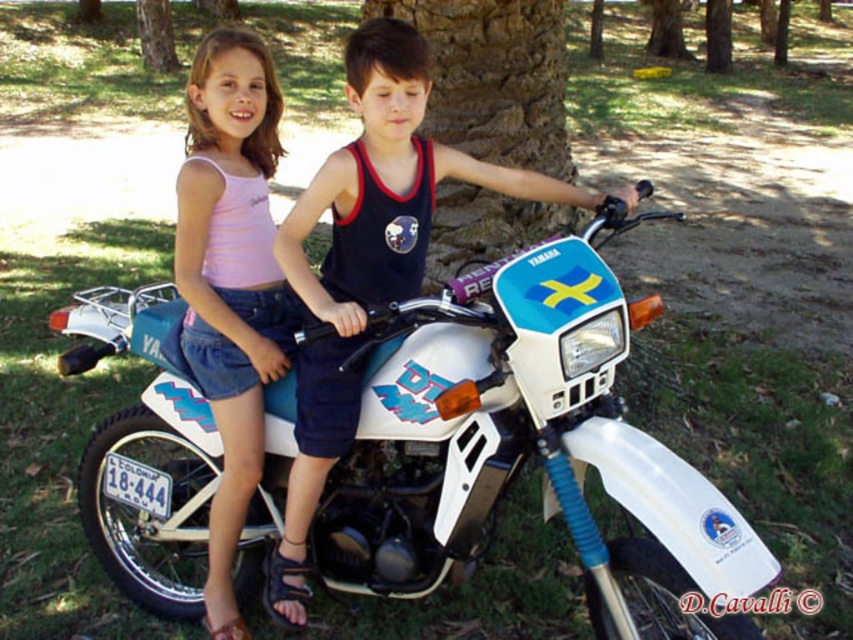
Question: Can you confirm if matte white tank top at center is wider than brown textured tree trunk at center?

Choices:
 (A) no
 (B) yes

Answer: (A)

Question: Which of the following is the closest to the observer?

Choices:
 (A) pink striped tank top at upper left
 (B) brown textured tree trunk at upper center
 (C) green textured bark at center

Answer: (A)

Question: Can you confirm if pink striped tank top at upper left is smaller than brown textured tree trunk at center?

Choices:
 (A) yes
 (B) no

Answer: (A)

Question: Which object is closer to the camera taking this photo?

Choices:
 (A) brown textured tree trunk at center
 (B) pink striped tank top at upper left
 (C) green textured bark at center
 (D) brown textured tree trunk at upper center

Answer: (B)

Question: In this image, where is matte white tank top at center located relative to pink striped tank top at upper left?

Choices:
 (A) left
 (B) right

Answer: (B)

Question: Which object appears closest to the camera in this image?

Choices:
 (A) brown textured tree trunk at center
 (B) green textured bark at center

Answer: (A)